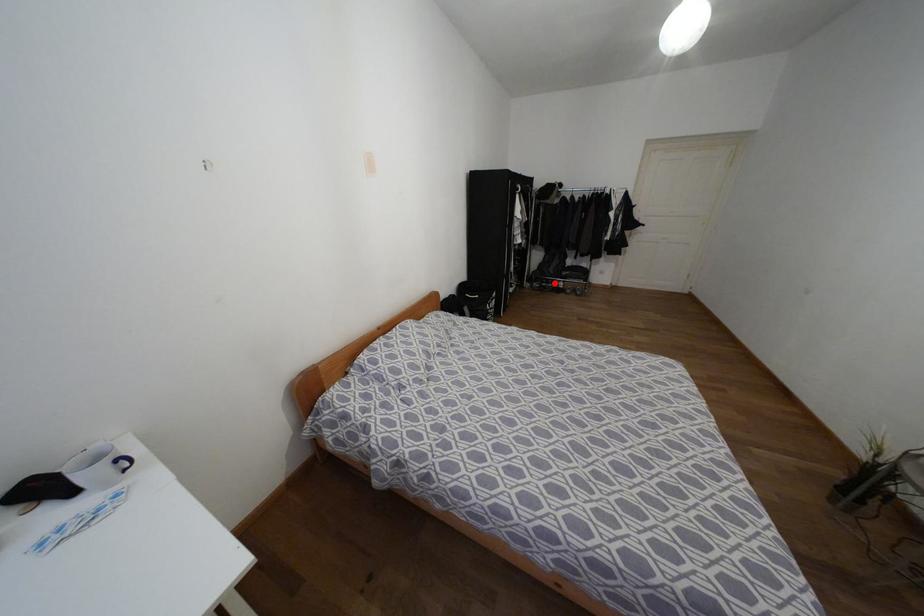
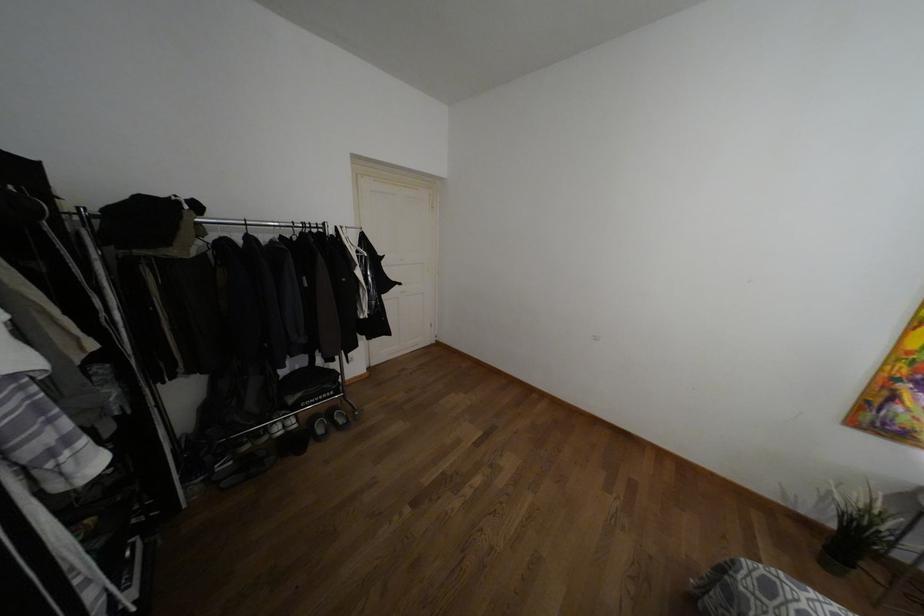
In the second image, find the point that corresponds to the highlighted location in the first image.

(275, 427)